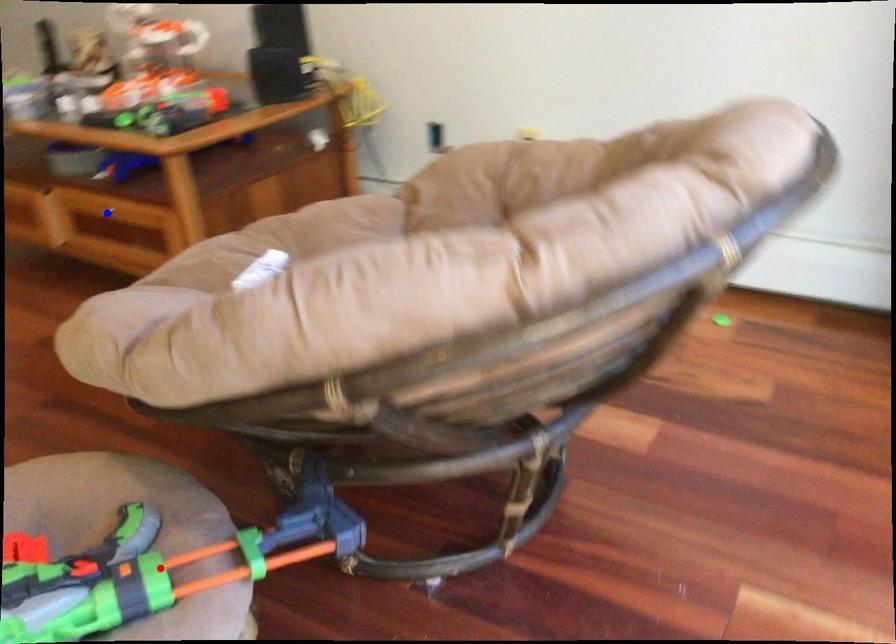
Question: In the image, two points are highlighted. Which point is nearer to the camera? Reply with the corresponding letter.

Choices:
 (A) blue point
 (B) red point

Answer: (B)